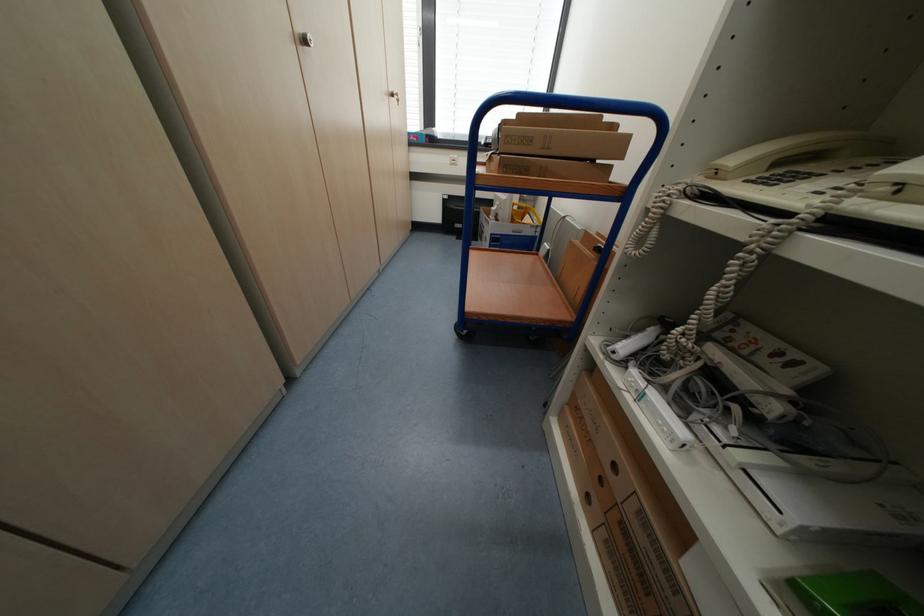
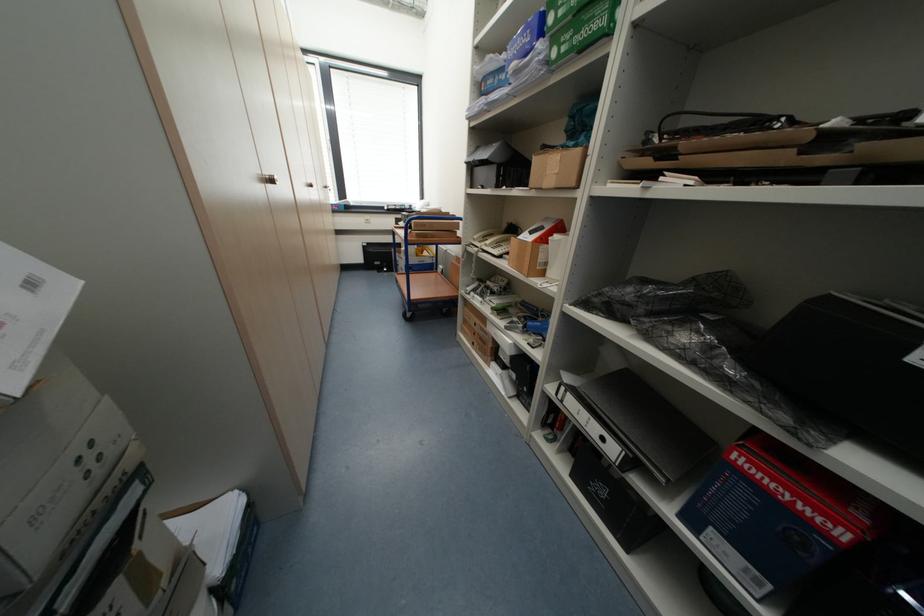
Find the pixel in the second image that matches the point at 723,175 in the first image.

(480, 240)